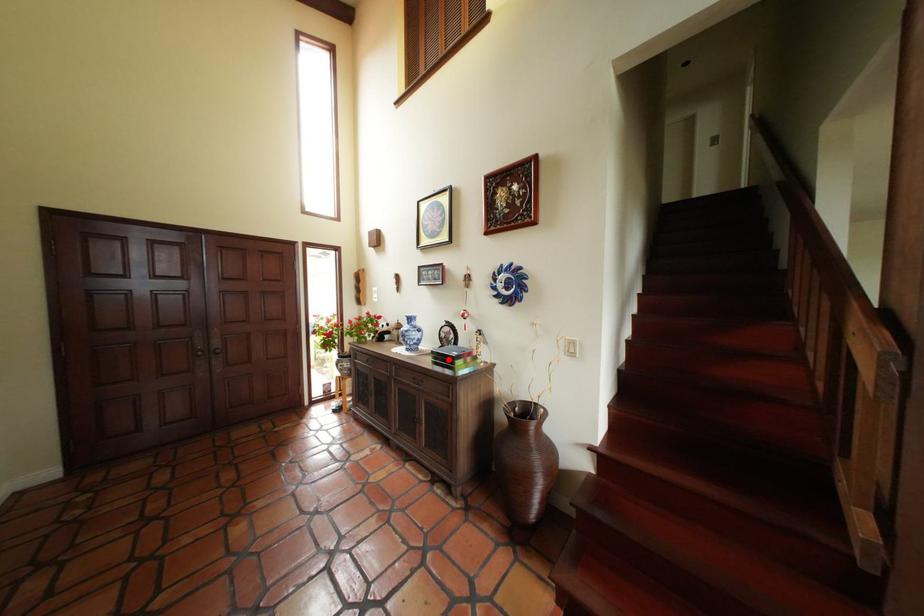
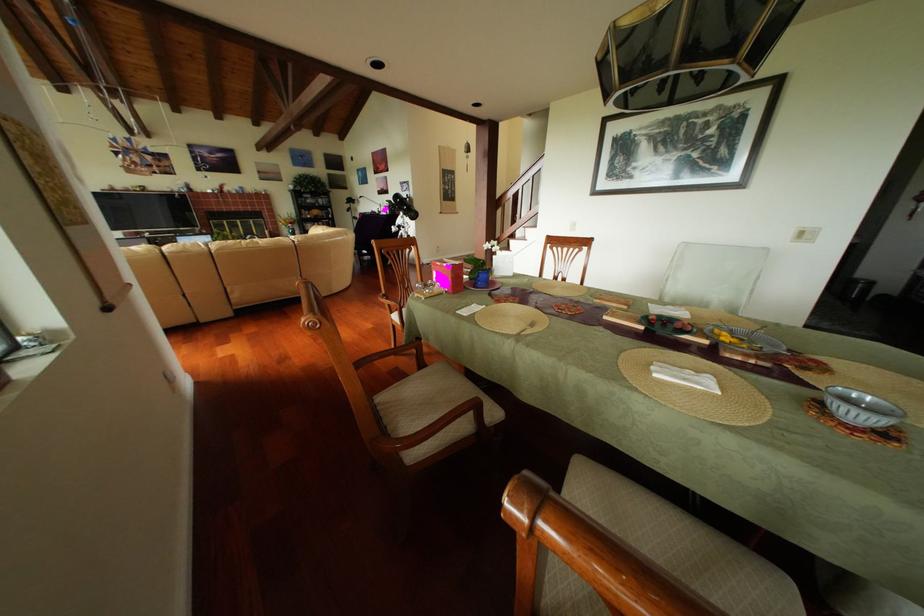
Question: I am providing you with two images of the same scene from different viewpoints. A red point is marked on the first image. Is the red point's position out of view in image 2?

Choices:
 (A) Yes
 (B) No

Answer: (A)